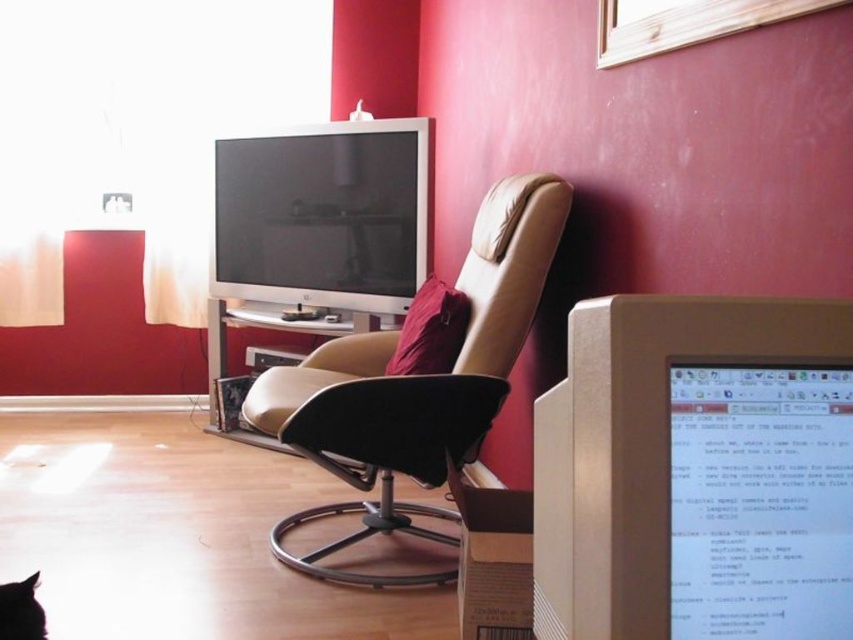
You are setting up a home office and need to place both the matte gray monitor at right and the matte black monitor at upper center on a desk that can only accommodate one monitor. Which monitor can fit better based on their widths?

The matte gray monitor at right has a smaller width compared to the matte black monitor at upper center, so it can fit better on the desk that can only accommodate one monitor.

Based on the photo, you are organizing a small gathering in the living room and need to place a rectangular table that is 1.5 meters wide between the matte white computer desk at center and the black fur cat at lower left. Based on their sizes, will the table fit between them?

The matte white computer desk at center is wider than the black fur cat at lower left. Since the table is 1.5 meters wide, and the desk is wider, there should be enough space between them to accommodate the table.

You are sitting on the beige leather recliner chair in front of the TV. You want to reach the matte white computer desk at center to grab your keys. Is the black fur cat at lower left closer to you than the desk?

The matte white computer desk at center is further to the viewer than black fur cat at lower left, so the cat is closer to you than the desk.